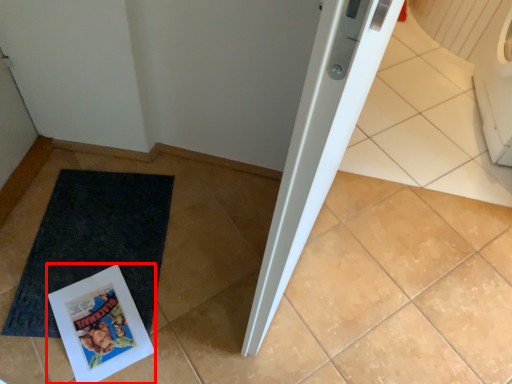
Question: From the image's perspective, where is comic book (annotated by the red box) located relative to mat?

Choices:
 (A) below
 (B) above

Answer: (A)